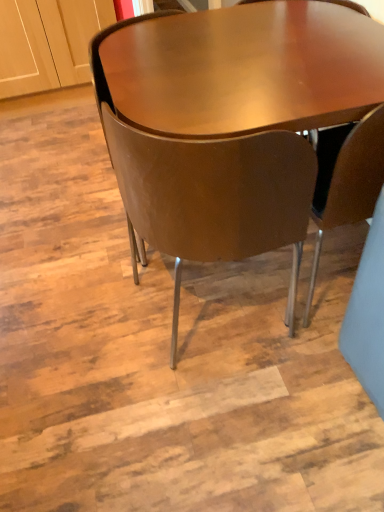
Image resolution: width=384 pixels, height=512 pixels. Describe the element at coordinates (101, 63) in the screenshot. I see `brown leather chair at center, marked as the first chair in a left-to-right arrangement` at that location.

What do you see at coordinates (346, 179) in the screenshot? This screenshot has height=512, width=384. I see `matte brown chair at center, which ranks as the first chair in right-to-left order` at bounding box center [346, 179].

Locate an element on the screen. This screenshot has width=384, height=512. brown leather chair at center, marked as the first chair in a left-to-right arrangement is located at coordinates (101, 63).

Considering the relative positions of matte brown chair at center, which ranks as the 3th chair in left-to-right order, and brown leather chair at center, marked as the first chair in a left-to-right arrangement, in the image provided, is matte brown chair at center, which ranks as the 3th chair in left-to-right order, to the right of brown leather chair at center, marked as the first chair in a left-to-right arrangement, from the viewer's perspective?

Yes, matte brown chair at center, which ranks as the 3th chair in left-to-right order, is to the right of brown leather chair at center, marked as the first chair in a left-to-right arrangement.

From a real-world perspective, is matte brown chair at center, which ranks as the 3th chair in left-to-right order, located beneath brown leather chair at center, marked as the first chair in a left-to-right arrangement?

Yes, from a real-world perspective, matte brown chair at center, which ranks as the 3th chair in left-to-right order, is beneath brown leather chair at center, marked as the first chair in a left-to-right arrangement.

From their relative heights in the image, would you say matte brown chair at center, which ranks as the first chair in right-to-left order, is taller or shorter than brown leather chair at center, marked as the first chair in a left-to-right arrangement?

In the image, matte brown chair at center, which ranks as the first chair in right-to-left order, appears to be shorter than brown leather chair at center, marked as the first chair in a left-to-right arrangement.

Could you tell me if brown leather chair at center, marked as the first chair in a left-to-right arrangement, is facing matte brown chair at center, which ranks as the first chair in right-to-left order?

No.

Is brown leather chair at center, which ranks as the 3th chair in right-to-left order, completely or partially outside of matte brown chair at center, which ranks as the first chair in right-to-left order?

Yes, brown leather chair at center, which ranks as the 3th chair in right-to-left order, is not within matte brown chair at center, which ranks as the first chair in right-to-left order.

Is brown leather chair at center, marked as the first chair in a left-to-right arrangement, at the right side of matte brown chair at center, which ranks as the 3th chair in left-to-right order?

No.

Looking at this image, is brown leather chair at center, marked as the first chair in a left-to-right arrangement, in front of matte brown chair at center, which ranks as the first chair in right-to-left order?

No, the depth of brown leather chair at center, marked as the first chair in a left-to-right arrangement, is greater than that of matte brown chair at center, which ranks as the first chair in right-to-left order.

Considering the positions of point (265, 248) and point (351, 172), is point (265, 248) closer or farther from the camera than point (351, 172)?

Clearly, point (265, 248) is more distant from the camera than point (351, 172).

From a real-world perspective, does brown leather chair at center, the 2th chair viewed from the right, sit lower than matte brown chair at center, which ranks as the 3th chair in left-to-right order?

Incorrect, from a real-world perspective, brown leather chair at center, the 2th chair viewed from the right, is higher than matte brown chair at center, which ranks as the 3th chair in left-to-right order.

Between brown leather chair at center, the 2th chair viewed from the right, and matte brown chair at center, which ranks as the 3th chair in left-to-right order, which one appears on the right side from the viewer's perspective?

Positioned to the right is matte brown chair at center, which ranks as the 3th chair in left-to-right order.

From the image's perspective, is brown leather chair at center, the 2th chair viewed from the right, on top of matte brown chair at center, which ranks as the 3th chair in left-to-right order?

Actually, brown leather chair at center, the 2th chair viewed from the right, appears below matte brown chair at center, which ranks as the 3th chair in left-to-right order, in the image.

Consider the image. Are brown leather chair at center, which is counted as the second chair, starting from the left, and brown leather chair at center, which ranks as the 3th chair in right-to-left order, making contact?

No, brown leather chair at center, which is counted as the second chair, starting from the left, is not next to brown leather chair at center, which ranks as the 3th chair in right-to-left order.

Who is bigger, brown leather chair at center, which is counted as the second chair, starting from the left, or brown leather chair at center, which ranks as the 3th chair in right-to-left order?

brown leather chair at center, which ranks as the 3th chair in right-to-left order.

Is brown leather chair at center, which is counted as the second chair, starting from the left, positioned with its back to brown leather chair at center, which ranks as the 3th chair in right-to-left order?

No, brown leather chair at center, which is counted as the second chair, starting from the left, is not facing the opposite direction of brown leather chair at center, which ranks as the 3th chair in right-to-left order.

In the image, is brown leather chair at center, marked as the first chair in a left-to-right arrangement, positioned in front of or behind brown leather chair at center, the 2th chair viewed from the right?

brown leather chair at center, marked as the first chair in a left-to-right arrangement, is behind brown leather chair at center, the 2th chair viewed from the right.

Is brown leather chair at center, which ranks as the 3th chair in right-to-left order, touching brown leather chair at center, the 2th chair viewed from the right?

No, brown leather chair at center, which ranks as the 3th chair in right-to-left order, is not beside brown leather chair at center, the 2th chair viewed from the right.

From a real-world perspective, is brown leather chair at center, marked as the first chair in a left-to-right arrangement, beneath brown leather chair at center, the 2th chair viewed from the right?

No, from a real-world perspective, brown leather chair at center, marked as the first chair in a left-to-right arrangement, is not under brown leather chair at center, the 2th chair viewed from the right.

In order to click on the 1st chair to the right of the brown leather chair at center, which ranks as the 3th chair in right-to-left order, starting your count from the anchor in this screenshot , I will do point(213,197).

Locate an element on the screen. This screenshot has width=384, height=512. chair that appears below the brown leather chair at center, the 2th chair viewed from the right (from a real-world perspective) is located at coordinates (346, 179).

From the picture: Can you confirm if matte brown chair at center, which ranks as the first chair in right-to-left order, is smaller than brown leather chair at center, the 2th chair viewed from the right?

Indeed, matte brown chair at center, which ranks as the first chair in right-to-left order, has a smaller size compared to brown leather chair at center, the 2th chair viewed from the right.

Considering the relative positions of matte brown chair at center, which ranks as the 3th chair in left-to-right order, and brown leather chair at center, which is counted as the second chair, starting from the left, in the image provided, is matte brown chair at center, which ranks as the 3th chair in left-to-right order, to the left or to the right of brown leather chair at center, which is counted as the second chair, starting from the left,?

matte brown chair at center, which ranks as the 3th chair in left-to-right order, is to the right of brown leather chair at center, which is counted as the second chair, starting from the left.

This screenshot has height=512, width=384. There is a matte brown chair at center, which ranks as the first chair in right-to-left order. Find the location of `the 2nd chair above it (from a real-world perspective)`. the 2nd chair above it (from a real-world perspective) is located at coordinates (101, 63).

Where is `chair that is behind the matte brown chair at center, which ranks as the 3th chair in left-to-right order`? This screenshot has height=512, width=384. chair that is behind the matte brown chair at center, which ranks as the 3th chair in left-to-right order is located at coordinates (101, 63).

When comparing their distances from brown leather chair at center, which is counted as the second chair, starting from the left, does matte brown chair at center, which ranks as the 3th chair in left-to-right order, or brown leather chair at center, which ranks as the 3th chair in right-to-left order, seem closer?

matte brown chair at center, which ranks as the 3th chair in left-to-right order, lies closer to brown leather chair at center, which is counted as the second chair, starting from the left, than the other object.

From the image, which object appears to be farther from brown leather chair at center, which ranks as the 3th chair in right-to-left order, brown leather chair at center, the 2th chair viewed from the right, or matte brown chair at center, which ranks as the first chair in right-to-left order?

Based on the image, matte brown chair at center, which ranks as the first chair in right-to-left order, appears to be further to brown leather chair at center, which ranks as the 3th chair in right-to-left order.

From the image, which object appears to be farther from matte brown chair at center, which ranks as the 3th chair in left-to-right order, brown leather chair at center, marked as the first chair in a left-to-right arrangement, or brown leather chair at center, the 2th chair viewed from the right?

Among the two, brown leather chair at center, marked as the first chair in a left-to-right arrangement, is located further to matte brown chair at center, which ranks as the 3th chair in left-to-right order.

Considering their positions, is brown leather chair at center, which is counted as the second chair, starting from the left, positioned closer to matte brown chair at center, which ranks as the first chair in right-to-left order, than brown leather chair at center, which ranks as the 3th chair in right-to-left order?

The object closer to matte brown chair at center, which ranks as the first chair in right-to-left order, is brown leather chair at center, which is counted as the second chair, starting from the left.

Considering their positions, is brown leather chair at center, marked as the first chair in a left-to-right arrangement, positioned further to brown leather chair at center, the 2th chair viewed from the right, than matte brown chair at center, which ranks as the first chair in right-to-left order?

brown leather chair at center, marked as the first chair in a left-to-right arrangement, lies further to brown leather chair at center, the 2th chair viewed from the right, than the other object.

When comparing their distances from brown leather chair at center, which ranks as the 3th chair in right-to-left order, does matte brown chair at center, which ranks as the 3th chair in left-to-right order, or brown leather chair at center, which is counted as the second chair, starting from the left, seem further?

matte brown chair at center, which ranks as the 3th chair in left-to-right order.

This screenshot has height=512, width=384. Find the location of `chair located between brown leather chair at center, marked as the first chair in a left-to-right arrangement, and matte brown chair at center, which ranks as the 3th chair in left-to-right order, in the left-right direction`. chair located between brown leather chair at center, marked as the first chair in a left-to-right arrangement, and matte brown chair at center, which ranks as the 3th chair in left-to-right order, in the left-right direction is located at coordinates (213, 197).